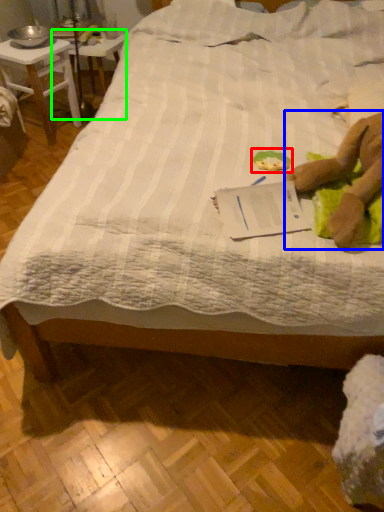
Question: Estimate the real-world distances between objects in this image. Which object is closer to toy (highlighted by a red box), person (highlighted by a blue box) or table (highlighted by a green box)?

Choices:
 (A) person
 (B) table

Answer: (A)